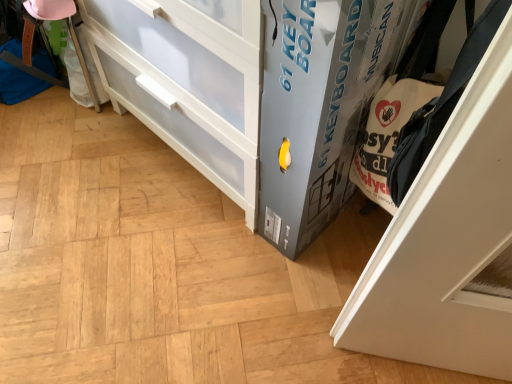
What do you see at coordinates (447, 242) in the screenshot? Image resolution: width=512 pixels, height=384 pixels. I see `white matte door at right` at bounding box center [447, 242].

What is the approximate height of white matte door at right?

It is 43.67 centimeters.

This screenshot has height=384, width=512. Identify the location of white matte door at right. (447, 242).

Identify the location of gray cardboard box at lower right. This screenshot has width=512, height=384. tap(316, 108).

This screenshot has height=384, width=512. What do you see at coordinates (316, 108) in the screenshot? I see `gray cardboard box at lower right` at bounding box center [316, 108].

Find the location of a particular element. The height and width of the screenshot is (384, 512). white matte door at right is located at coordinates point(447,242).

Does gray cardboard box at lower right appear on the left side of white matte door at right?

Yes.

Who is more distant, gray cardboard box at lower right or white matte door at right?

gray cardboard box at lower right is behind.

Looking at this image, which point is more distant from viewer, [307,18] or [461,332]?

Point [461,332]

From the image's perspective, is gray cardboard box at lower right above or below white matte door at right?

gray cardboard box at lower right is situated higher than white matte door at right in the image.

From a real-world perspective, is gray cardboard box at lower right on top of white matte door at right?

No.

Considering the sizes of objects gray cardboard box at lower right and white matte door at right in the image provided, who is wider, gray cardboard box at lower right or white matte door at right?

gray cardboard box at lower right is wider.

Can you confirm if gray cardboard box at lower right is shorter than white matte door at right?

No.

Can you confirm if gray cardboard box at lower right is bigger than white matte door at right?

Yes, gray cardboard box at lower right is bigger than white matte door at right.

Would you say gray cardboard box at lower right contains white matte door at right?

No, white matte door at right is not surrounded by gray cardboard box at lower right.

Are gray cardboard box at lower right and white matte door at right located far from each other?

gray cardboard box at lower right is actually quite close to white matte door at right.

Looking at this image, is gray cardboard box at lower right oriented away from white matte door at right?

That's not correct — gray cardboard box at lower right is not looking away from white matte door at right.

What's the angular difference between gray cardboard box at lower right and white matte door at right's facing directions?

There is a 0.113-degree angle between the facing directions of gray cardboard box at lower right and white matte door at right.

Locate an element on the screen. This screenshot has width=512, height=384. door below the gray cardboard box at lower right (from the image's perspective) is located at coordinates (447, 242).

Is white matte door at right to the right of gray cardboard box at lower right from the viewer's perspective?

Correct, you'll find white matte door at right to the right of gray cardboard box at lower right.

Is the depth of white matte door at right greater than that of gray cardboard box at lower right?

No, it is not.

Is point (455, 224) farther from camera compared to point (376, 36)?

No, (455, 224) is in front of (376, 36).

From the image's perspective, does white matte door at right appear lower than gray cardboard box at lower right?

Yes.

From a real-world perspective, is white matte door at right above or below gray cardboard box at lower right?

Clearly, from a real-world perspective, white matte door at right is above gray cardboard box at lower right.

Which object is thinner, white matte door at right or gray cardboard box at lower right?

white matte door at right is thinner.

In terms of height, does white matte door at right look taller or shorter compared to gray cardboard box at lower right?

In the image, white matte door at right appears to be shorter than gray cardboard box at lower right.

Which of these two, white matte door at right or gray cardboard box at lower right, is smaller?

Smaller between the two is white matte door at right.

Is white matte door at right located outside gray cardboard box at lower right?

white matte door at right is positioned outside gray cardboard box at lower right.

Is white matte door at right with gray cardboard box at lower right?

No, white matte door at right is not touching gray cardboard box at lower right.

Is white matte door at right facing away from gray cardboard box at lower right?

white matte door at right does not have its back to gray cardboard box at lower right.

Can you tell me how much white matte door at right and gray cardboard box at lower right differ in facing direction?

0.113 degrees separate the facing orientations of white matte door at right and gray cardboard box at lower right.

At what (x,y) coordinates should I click in order to perform the action: click on cabinetry lying on the left of white matte door at right. Please return your answer as a coordinate pair (x, y). This screenshot has height=384, width=512. Looking at the image, I should click on (316, 108).

In the image, there is a white matte door at right. At what (x,y) coordinates should I click in order to perform the action: click on cabinetry above it (from the image's perspective). Please return your answer as a coordinate pair (x, y). Looking at the image, I should click on (316, 108).

This screenshot has width=512, height=384. Identify the location of cabinetry that is under the white matte door at right (from a real-world perspective). (316, 108).